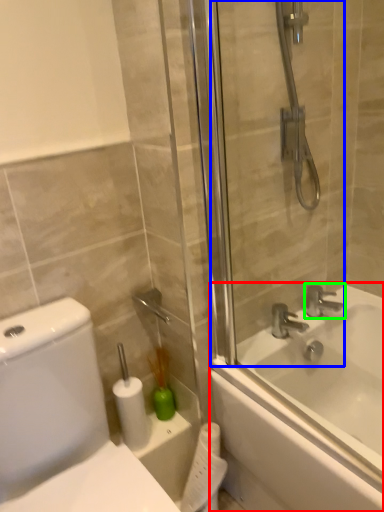
Question: Which object is positioned closest to bathtub (highlighted by a red box)? Select from screen door (highlighted by a blue box) and tap (highlighted by a green box).

Choices:
 (A) screen door
 (B) tap

Answer: (B)